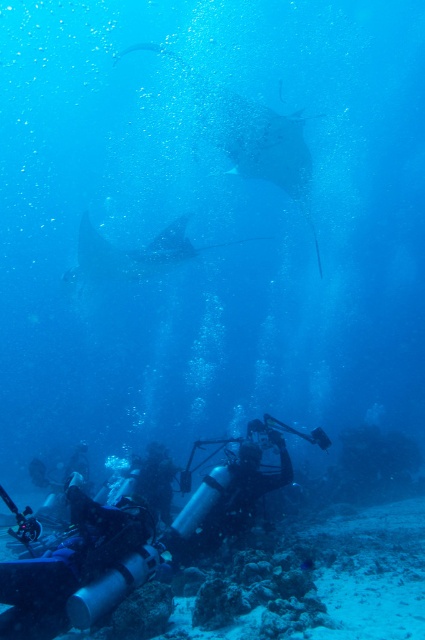
Between black rubber diving suit at lower center and smooth gray stingray at center, which one is positioned higher?

Positioned higher is smooth gray stingray at center.

Can you confirm if black rubber diving suit at lower center is positioned below smooth gray stingray at center?

Indeed, black rubber diving suit at lower center is positioned under smooth gray stingray at center.

Locate an element on the screen. black rubber diving suit at lower center is located at coordinates (226, 499).

Locate an element on the screen. black rubber diving suit at lower center is located at coordinates (226, 499).